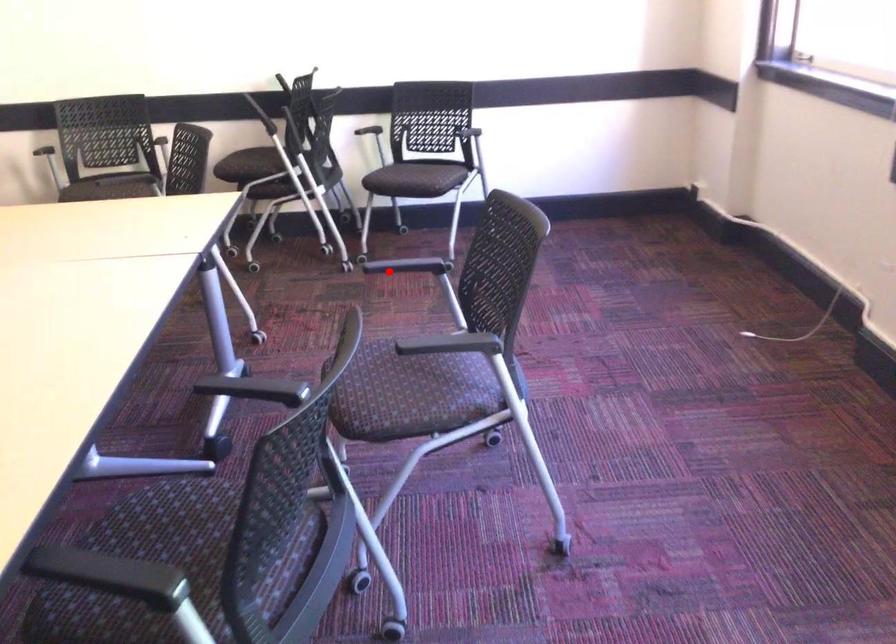
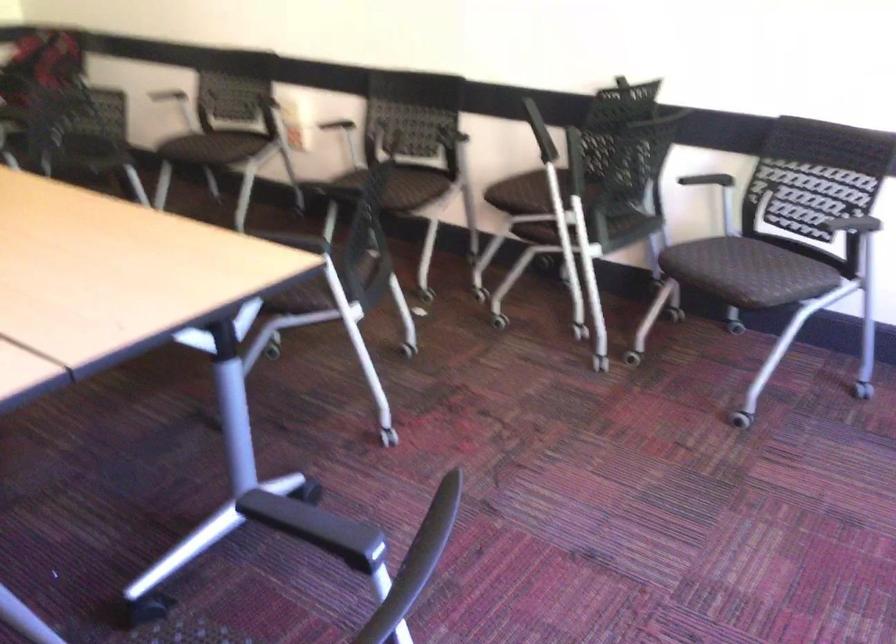
Question: I am providing you with two images of the same scene from different viewpoints. A red point is shown in image1. For the corresponding object point in image2, is it positioned nearer or farther from the camera?

Choices:
 (A) Nearer
 (B) Farther

Answer: (A)